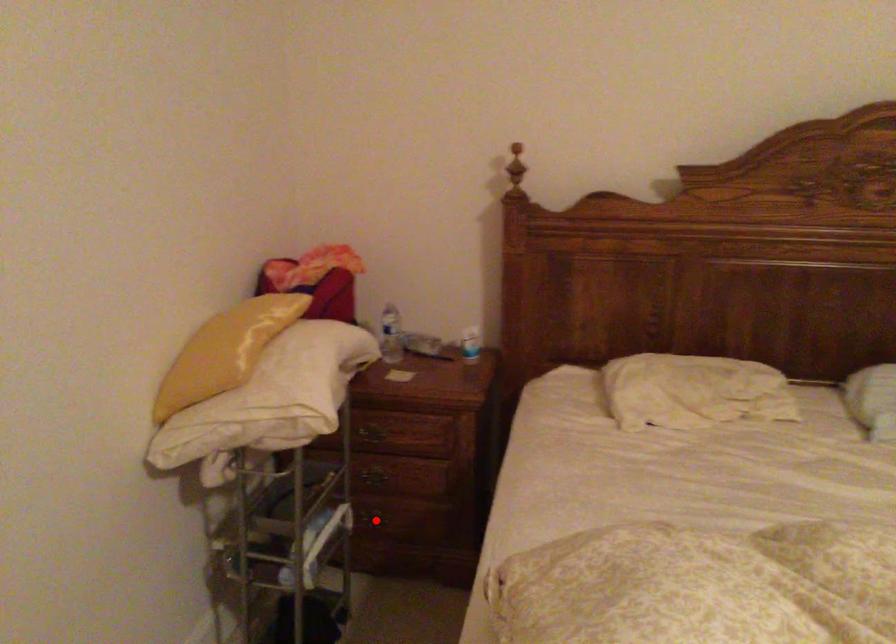
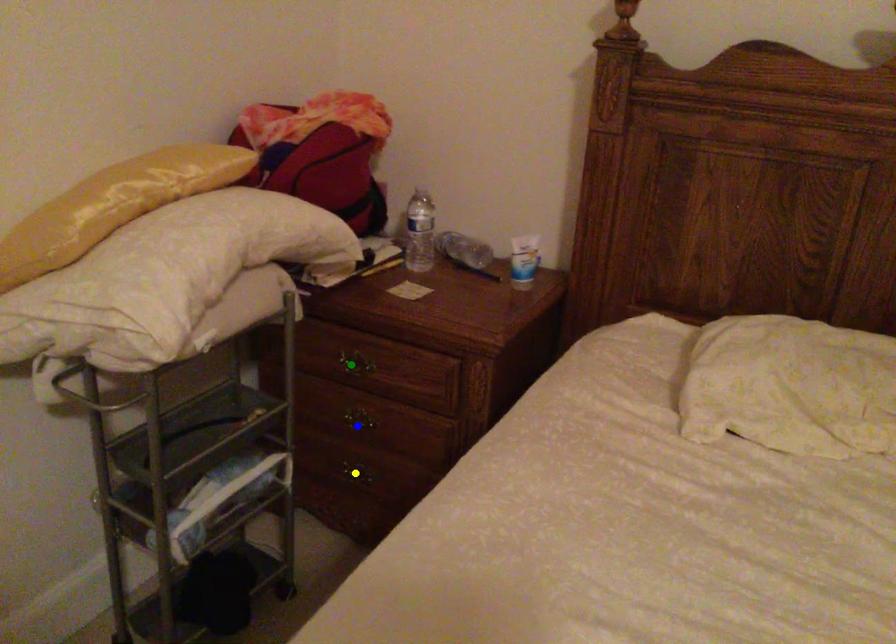
Question: I am providing you with two images of the same scene from different viewpoints. A red point is marked on the first image. You are given multiple points on the second image. In image 2, which mark is for the same physical point as the one in image 1?

Choices:
 (A) blue point
 (B) yellow point
 (C) green point

Answer: (B)